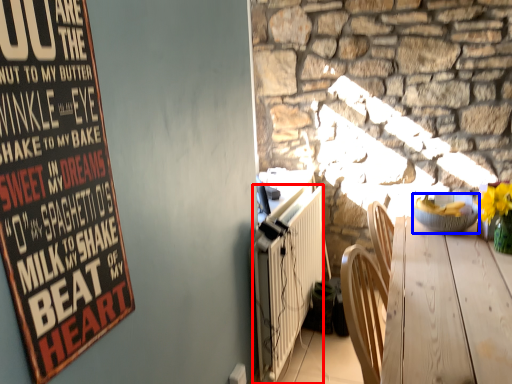
Question: Which object appears farthest to the camera in this image, radiator (highlighted by a red box) or bowl (highlighted by a blue box)?

Choices:
 (A) radiator
 (B) bowl

Answer: (B)